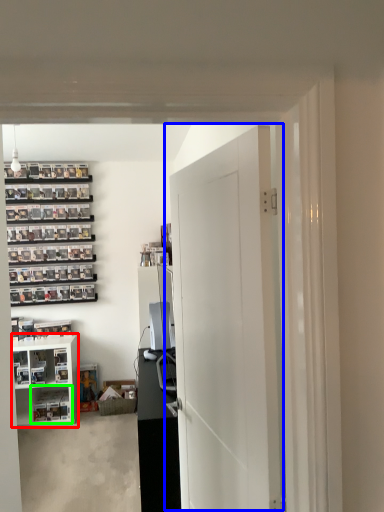
Question: Based on their relative distances, which object is nearer to cabinetry (highlighted by a red box)? Choose from door (highlighted by a blue box) and shelf (highlighted by a green box).

Choices:
 (A) door
 (B) shelf

Answer: (B)